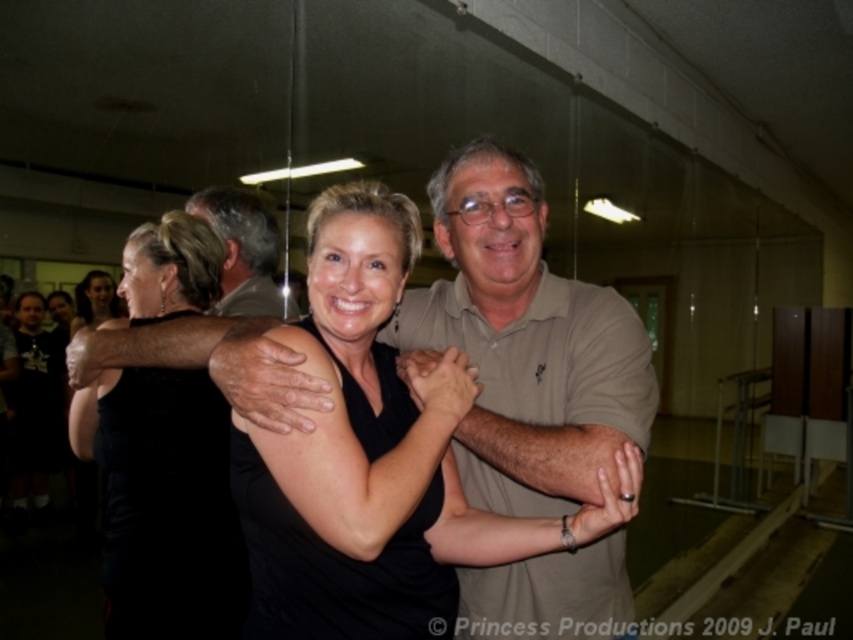
In the scene shown: Is matte khaki polo shirt at center below black matte dress at center?

Incorrect, matte khaki polo shirt at center is not positioned below black matte dress at center.

Between point (480, 579) and point (135, 480), which one is positioned in front?

Point (480, 579) is more forward.

Who is more forward, (518, 608) or (135, 468)?

Point (518, 608) is in front.

The image size is (853, 640). I want to click on matte khaki polo shirt at center, so click(524, 342).

Does matte khaki polo shirt at center have a smaller size compared to black dress at center?

Correct, matte khaki polo shirt at center occupies less space than black dress at center.

Is matte khaki polo shirt at center wider than black dress at center?

No, matte khaki polo shirt at center is not wider than black dress at center.

Describe the element at coordinates (524, 342) in the screenshot. The image size is (853, 640). I see `matte khaki polo shirt at center` at that location.

At what (x,y) coordinates should I click in order to perform the action: click on matte khaki polo shirt at center. Please return your answer as a coordinate pair (x, y). The width and height of the screenshot is (853, 640). Looking at the image, I should click on (524, 342).

Can you confirm if matte khaki polo shirt at center is smaller than gray hair at upper left?

No.

Can you confirm if matte khaki polo shirt at center is taller than gray hair at upper left?

Yes, matte khaki polo shirt at center is taller than gray hair at upper left.

The height and width of the screenshot is (640, 853). In order to click on matte khaki polo shirt at center in this screenshot , I will do `click(524, 342)`.

At what (x,y) coordinates should I click in order to perform the action: click on matte khaki polo shirt at center. Please return your answer as a coordinate pair (x, y). Looking at the image, I should click on (524, 342).